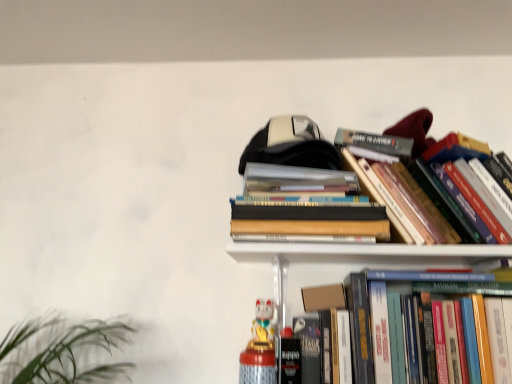
Question: Can you confirm if hardcover books at upper center, which is counted as the 2th book, starting from the top, is bigger than hardcover book at center right, the third book in the top-to-bottom sequence?

Choices:
 (A) no
 (B) yes

Answer: (A)

Question: Can you confirm if hardcover books at upper center, which is counted as the 2th book, starting from the top, is taller than hardcover book at center right, positioned as the 1th book in bottom-to-top order?

Choices:
 (A) no
 (B) yes

Answer: (A)

Question: Does hardcover books at upper center, which ranks as the 2th book in bottom-to-top order, have a smaller size compared to hardcover book at center right, positioned as the 1th book in bottom-to-top order?

Choices:
 (A) yes
 (B) no

Answer: (A)

Question: Does hardcover books at upper center, which ranks as the 2th book in bottom-to-top order, lie in front of hardcover book at center right, the third book in the top-to-bottom sequence?

Choices:
 (A) no
 (B) yes

Answer: (A)

Question: From a real-world perspective, does hardcover books at upper center, which is counted as the 2th book, starting from the top, sit lower than hardcover book at center right, positioned as the 1th book in bottom-to-top order?

Choices:
 (A) no
 (B) yes

Answer: (A)

Question: From the image's perspective, is hardcover books at upper center, which is counted as the 2th book, starting from the top, under hardcover book at center right, positioned as the 1th book in bottom-to-top order?

Choices:
 (A) yes
 (B) no

Answer: (B)

Question: Considering the relative positions of cardboard box at upper center and hardcover books at upper center, which ranks as the 2th book in bottom-to-top order, in the image provided, is cardboard box at upper center to the left of hardcover books at upper center, which ranks as the 2th book in bottom-to-top order, from the viewer's perspective?

Choices:
 (A) yes
 (B) no

Answer: (B)

Question: From the image's perspective, is cardboard box at upper center located beneath hardcover books at upper center, which ranks as the 2th book in bottom-to-top order?

Choices:
 (A) no
 (B) yes

Answer: (B)

Question: From a real-world perspective, is cardboard box at upper center positioned under hardcover books at upper center, which is counted as the 2th book, starting from the top, based on gravity?

Choices:
 (A) no
 (B) yes

Answer: (B)

Question: Is cardboard box at upper center oriented away from hardcover books at upper center, which is counted as the 2th book, starting from the top?

Choices:
 (A) yes
 (B) no

Answer: (B)

Question: Could you tell me if cardboard box at upper center is facing hardcover books at upper center, which ranks as the 2th book in bottom-to-top order?

Choices:
 (A) yes
 (B) no

Answer: (B)

Question: Does cardboard box at upper center lie behind hardcover books at upper center, which ranks as the 2th book in bottom-to-top order?

Choices:
 (A) yes
 (B) no

Answer: (A)

Question: Is white glossy cat figurine at lower center at the left side of cardboard box at upper center?

Choices:
 (A) yes
 (B) no

Answer: (A)